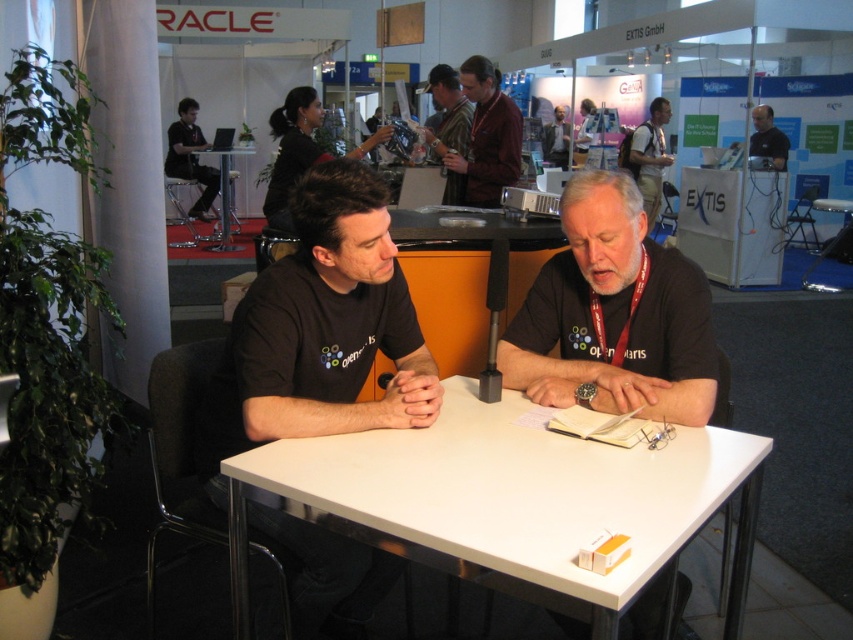
Question: Among these points, which one is nearest to the camera?

Choices:
 (A) (467, 385)
 (B) (541, 396)
 (C) (467, 120)
 (D) (228, 173)

Answer: (B)

Question: Does black fabric shirt at center have a lesser width compared to white plastic table at center?

Choices:
 (A) yes
 (B) no

Answer: (A)

Question: Is black fabric shirt at center smaller than dark brown leather backpack at upper right?

Choices:
 (A) no
 (B) yes

Answer: (B)

Question: Which of these objects is positioned closest to the black fabric shirt at center?

Choices:
 (A) brown matte shirt at upper center
 (B) dark brown leather backpack at upper right
 (C) transparent plastic table at center
 (D) black matte shirt at center

Answer: (D)

Question: Can you confirm if black matte shirt at center is positioned to the left of black fabric shirt at center?

Choices:
 (A) no
 (B) yes

Answer: (B)

Question: Which of the following is the farthest from the observer?

Choices:
 (A) (207, 170)
 (B) (448, 122)
 (C) (640, 140)
 (D) (440, 208)

Answer: (A)